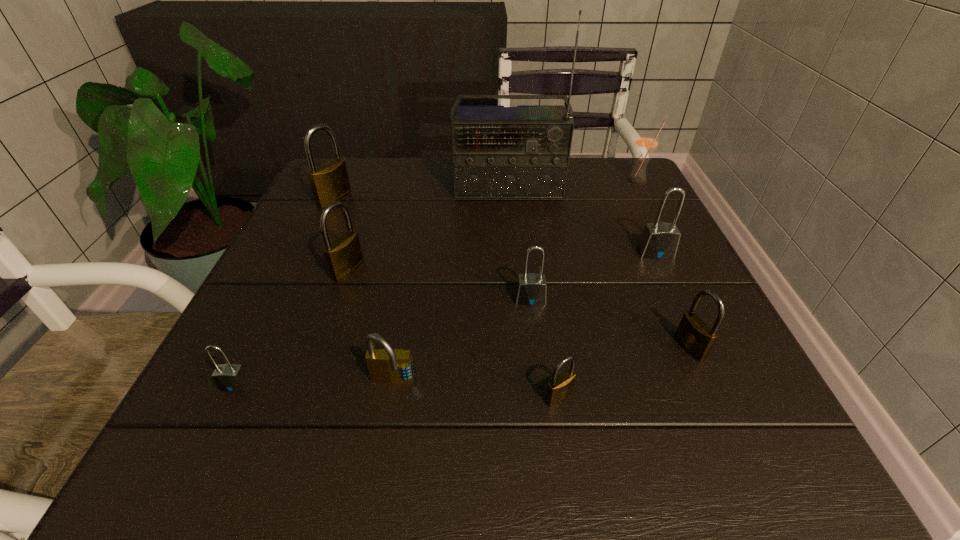
Image resolution: width=960 pixels, height=540 pixels. What are the coordinates of `the second gray padlock from left to right` in the screenshot? It's located at (531, 290).

In order to click on the third biggest brass padlock in this screenshot , I will do `click(695, 336)`.

This screenshot has height=540, width=960. I want to click on the rightmost brass padlock, so click(695, 336).

Where is `the fourth object from left to right`? This screenshot has width=960, height=540. the fourth object from left to right is located at coordinates (388, 365).

Where is `the nearest gray padlock`? the nearest gray padlock is located at coordinates (228, 377).

This screenshot has height=540, width=960. Find the location of `the leftmost gray padlock`. the leftmost gray padlock is located at coordinates (228, 377).

This screenshot has height=540, width=960. What are the coordinates of `the third brass padlock from left to right` in the screenshot? It's located at (561, 386).

Identify the location of the smallest brass padlock. This screenshot has width=960, height=540. (561, 386).

This screenshot has height=540, width=960. Find the location of `vacant space located on the front panel of the radio receiver`. vacant space located on the front panel of the radio receiver is located at coordinates (519, 311).

Locate an element on the screen. free space located 0.120m on the back of the leftmost brass padlock is located at coordinates (349, 166).